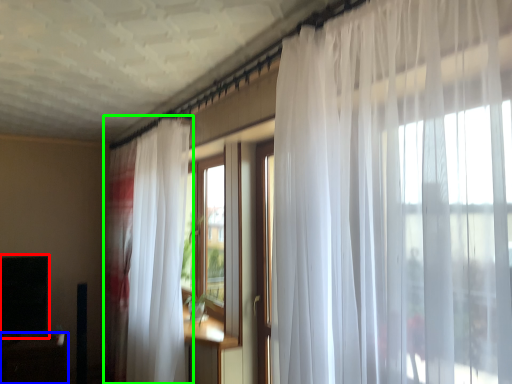
Question: Estimate the real-world distances between objects in this image. Which object is farther from window screen (highlighted by a red box), table (highlighted by a blue box) or curtain (highlighted by a green box)?

Choices:
 (A) table
 (B) curtain

Answer: (B)